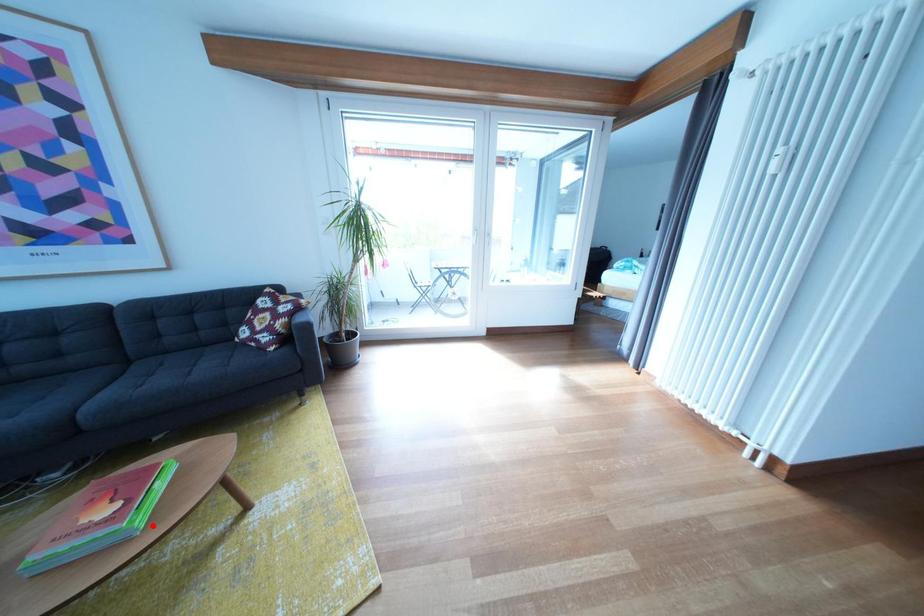
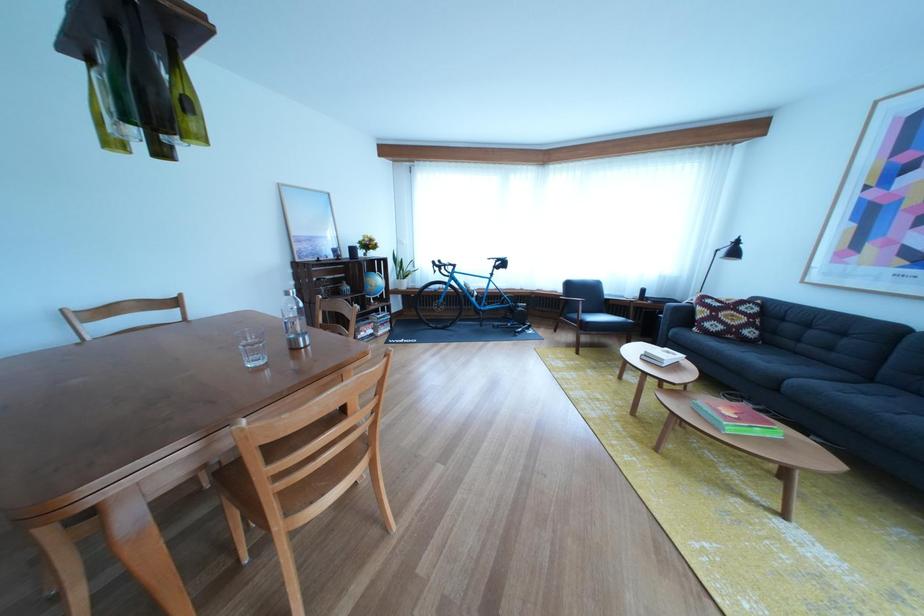
Question: I am providing you with two images of the same scene from different viewpoints. Image1 has a red point marked. In image2, the corresponding 3D location appears at what relative position? Reply with the corresponding letter.

Choices:
 (A) Closer
 (B) Farther

Answer: (B)